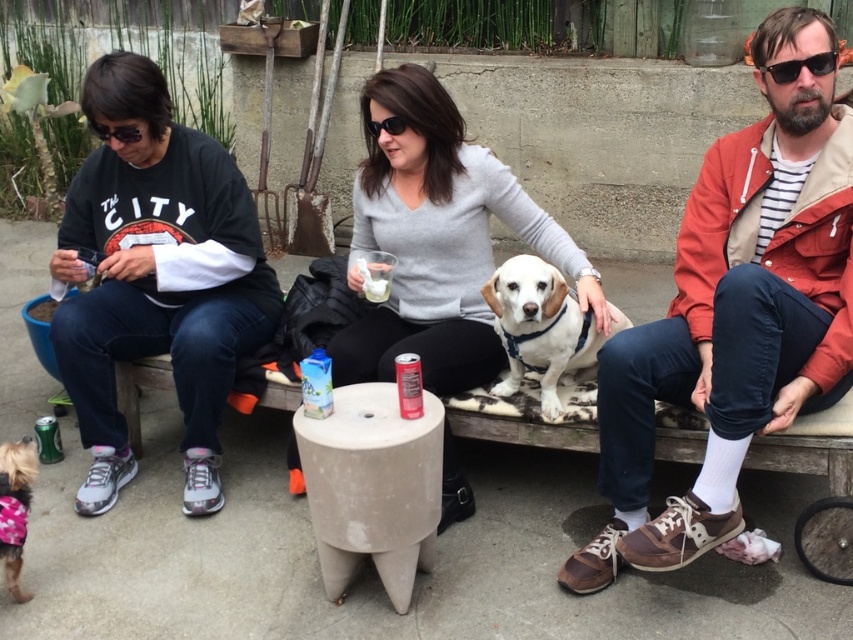
Question: Is black cotton shirt at left above white soft fur dog at center?

Choices:
 (A) yes
 (B) no

Answer: (A)

Question: Which of the following is the closest to the observer?

Choices:
 (A) pink fabric dog at lower left
 (B) concrete textured stool at center
 (C) sunglasses at upper right

Answer: (B)

Question: Is black cotton shirt at left positioned at the back of gray sweater at center?

Choices:
 (A) no
 (B) yes

Answer: (B)

Question: Which of the following is the farthest from the observer?

Choices:
 (A) white soft fur dog at center
 (B) black plastic sunglasses at center

Answer: (B)

Question: Which object is positioned farthest from the black plastic sunglasses at center?

Choices:
 (A) pink fabric dog at lower left
 (B) red leather jacket at right
 (C) black cotton shirt at left
 (D) white soft fur dog at center

Answer: (A)

Question: Observing the image, what is the correct spatial positioning of red leather jacket at right in reference to pink fabric dog at lower left?

Choices:
 (A) left
 (B) right

Answer: (B)